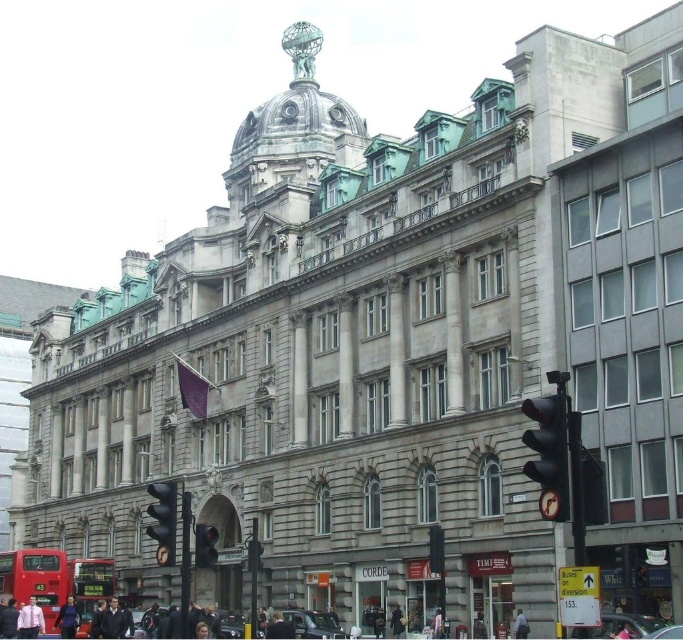
Is black matte traffic light at center thinner than dark gray jacket at center?

No, black matte traffic light at center is not thinner than dark gray jacket at center.

Who is taller, black matte traffic light at center or dark gray jacket at center?

Standing taller between the two is black matte traffic light at center.

Does point (210, 541) come farther from viewer compared to point (479, 634)?

No, (210, 541) is in front of (479, 634).

The width and height of the screenshot is (683, 640). In order to click on black matte traffic light at center in this screenshot , I will do `click(206, 545)`.

Consider the image. Can you confirm if black glass traffic light at lower left is smaller than dark gray suit at center?

No.

Which is behind, point (171, 518) or point (514, 630)?

Point (514, 630)

In order to click on black glass traffic light at lower left in this screenshot , I will do `click(163, 520)`.

Where is `black glass traffic light at lower left`? This screenshot has height=640, width=683. black glass traffic light at lower left is located at coordinates (163, 520).

Can you confirm if dark suit at lower center is positioned to the left of dark gray jacket at center?

Yes, dark suit at lower center is to the left of dark gray jacket at center.

Does dark suit at lower center appear on the right side of dark gray jacket at center?

Incorrect, dark suit at lower center is not on the right side of dark gray jacket at center.

Is point (128, 632) in front of point (482, 616)?

No, it is not.

The image size is (683, 640). What are the coordinates of `dark suit at lower center` in the screenshot? It's located at (111, 621).